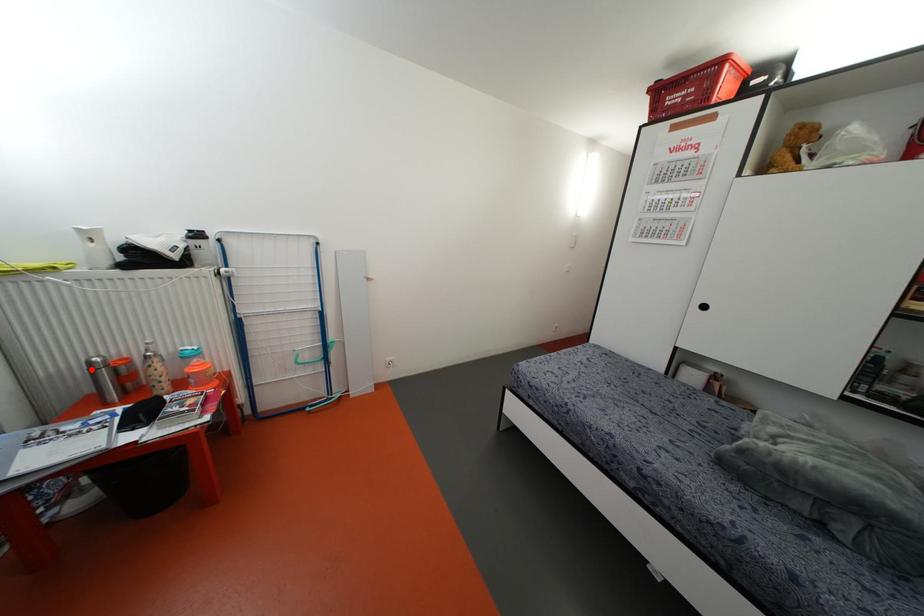
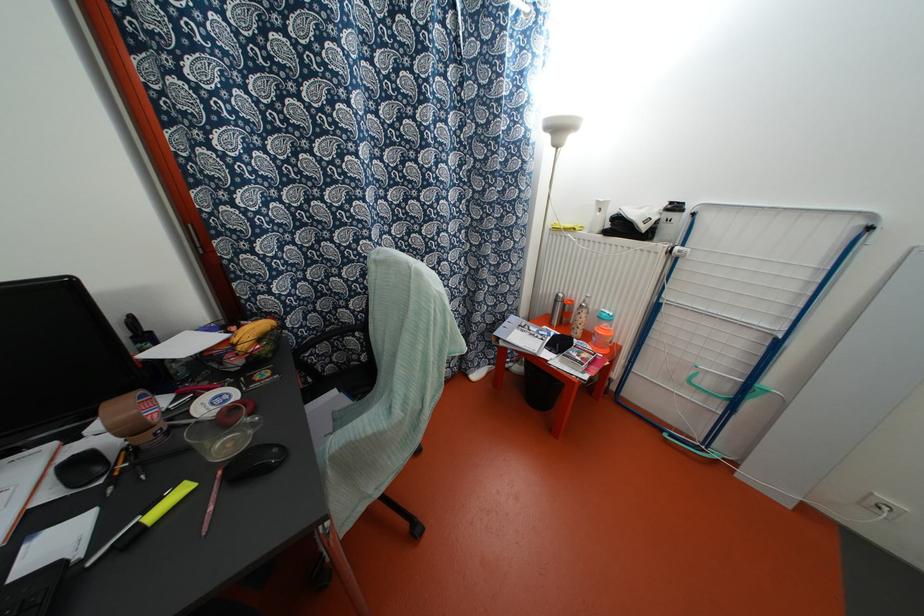
Find the pixel in the second image that matches the highlighted location in the first image.

(554, 301)